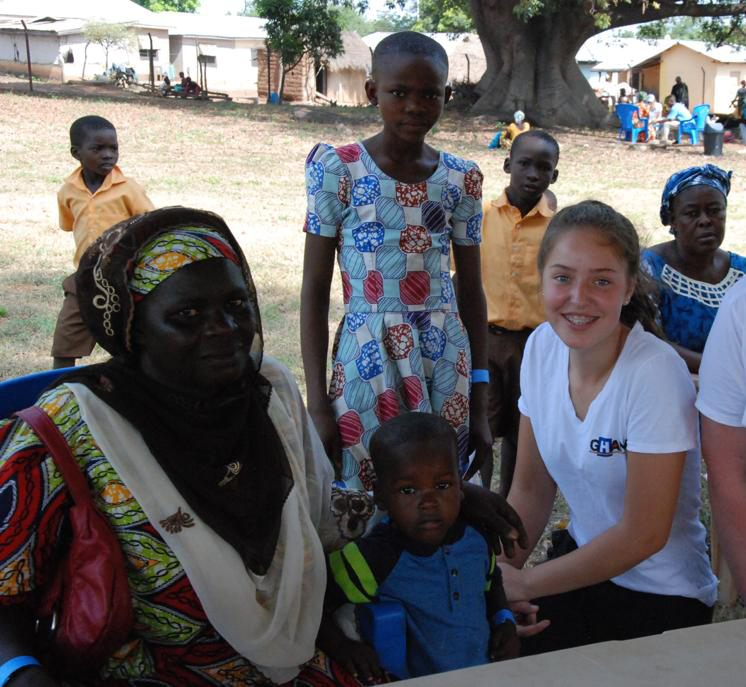
You are a GUI agent. You are given a task and a screenshot of the screen. Output one action in this format:
    pyautogui.click(x=<x>, y=<y>)
    Task: Click on the trash can
    
    Given the screenshot: What is the action you would take?
    pyautogui.click(x=715, y=143)